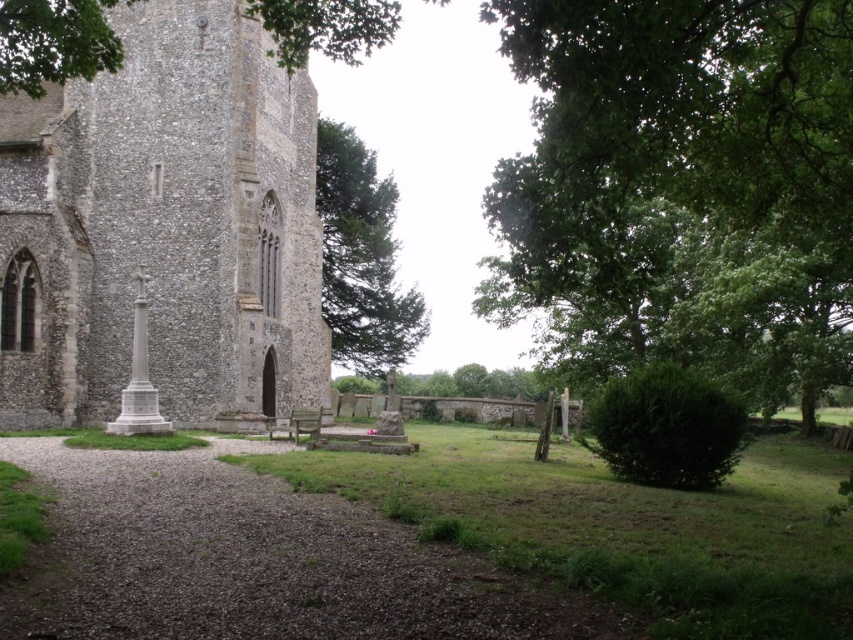
You are a visitor to the churchyard and want to sit on the wooden park bench at center. However, you notice the green leafy tree at upper left might block sunlight. Is the tree located above the bench, making shade possible?

The green leafy tree at upper left is positioned over the wooden park bench at center, so yes, the tree is above the bench and can provide shade.